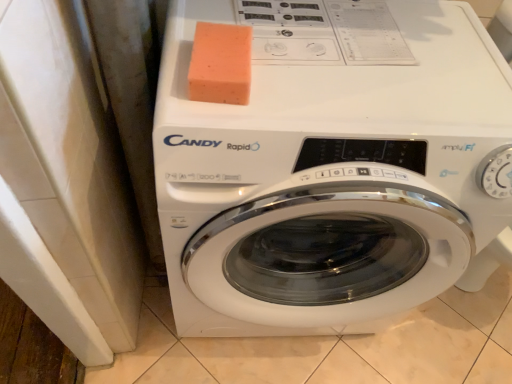
Question: Can we say orange sponge at upper center lies outside white glossy washing machine at center?

Choices:
 (A) no
 (B) yes

Answer: (A)

Question: Considering the relative sizes of orange sponge at upper center and white glossy washing machine at center in the image provided, is orange sponge at upper center bigger than white glossy washing machine at center?

Choices:
 (A) no
 (B) yes

Answer: (A)

Question: Can you confirm if orange sponge at upper center is smaller than white glossy washing machine at center?

Choices:
 (A) no
 (B) yes

Answer: (B)

Question: Is orange sponge at upper center thinner than white glossy washing machine at center?

Choices:
 (A) yes
 (B) no

Answer: (A)

Question: Can you confirm if orange sponge at upper center is positioned to the right of white glossy washing machine at center?

Choices:
 (A) no
 (B) yes

Answer: (A)

Question: Is orange sponge at upper center oriented towards white glossy washing machine at center?

Choices:
 (A) no
 (B) yes

Answer: (A)

Question: Is white glossy washing machine at center positioned far away from orange sponge at upper center?

Choices:
 (A) no
 (B) yes

Answer: (A)

Question: Does white glossy washing machine at center have a smaller size compared to orange sponge at upper center?

Choices:
 (A) yes
 (B) no

Answer: (B)

Question: Can you confirm if white glossy washing machine at center is wider than orange sponge at upper center?

Choices:
 (A) no
 (B) yes

Answer: (B)

Question: Is white glossy washing machine at center closer to camera compared to orange sponge at upper center?

Choices:
 (A) yes
 (B) no

Answer: (A)

Question: Is white glossy washing machine at center bigger than orange sponge at upper center?

Choices:
 (A) no
 (B) yes

Answer: (B)

Question: Does white glossy washing machine at center have a lesser width compared to orange sponge at upper center?

Choices:
 (A) yes
 (B) no

Answer: (B)

Question: In terms of width, does orange sponge at upper center look wider or thinner when compared to white glossy washing machine at center?

Choices:
 (A) thin
 (B) wide

Answer: (A)